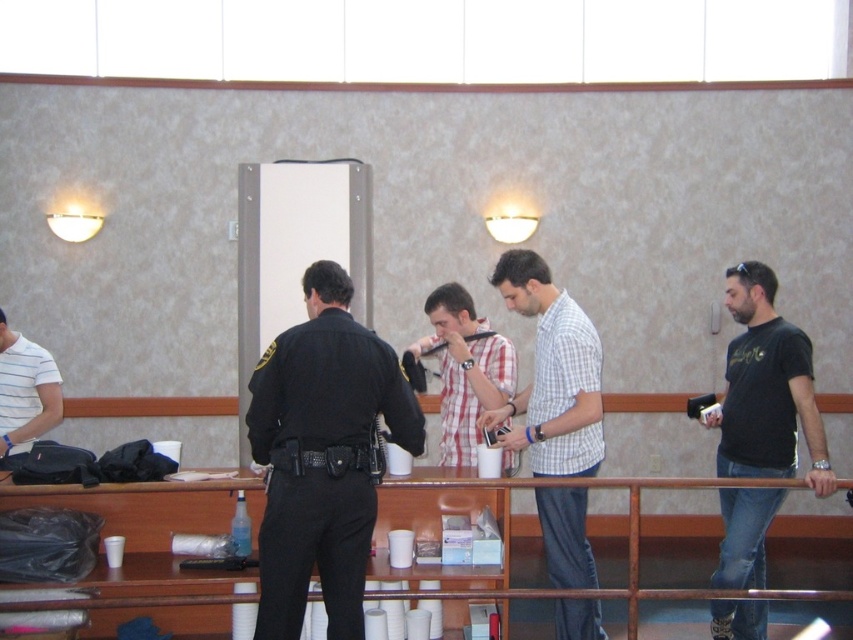
Question: Which point appears farthest from the camera in this image?

Choices:
 (A) (6, 353)
 (B) (463, 321)
 (C) (274, 580)

Answer: (A)

Question: Does metal at center appear under black matte t-shirt at right?

Choices:
 (A) yes
 (B) no

Answer: (A)

Question: Which of the following is the farthest from the observer?

Choices:
 (A) metal at center
 (B) white striped shirt at left

Answer: (B)

Question: Does black matte t-shirt at right have a smaller size compared to plaid cotton shirt at center?

Choices:
 (A) no
 (B) yes

Answer: (A)

Question: Is plaid cotton shirt at center behind white striped shirt at left?

Choices:
 (A) yes
 (B) no

Answer: (B)

Question: Among these objects, which one is farthest from the camera?

Choices:
 (A) black uniform at center
 (B) checkered fabric shirt at center

Answer: (B)